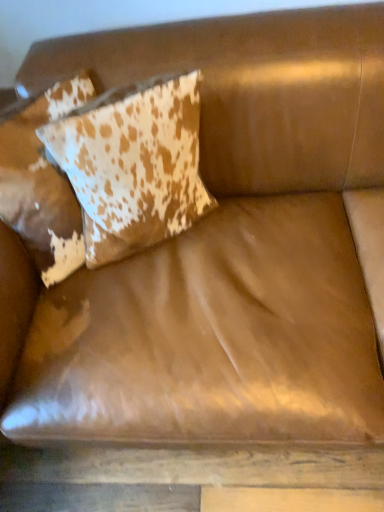
The height and width of the screenshot is (512, 384). What do you see at coordinates (133, 164) in the screenshot?
I see `cowhide pillow at upper left, which appears as the 2th pillow when viewed from the left` at bounding box center [133, 164].

The height and width of the screenshot is (512, 384). I want to click on cowhide pillow at upper left, which appears as the 2th pillow when viewed from the left, so click(133, 164).

Identify the location of cowhide pillow at upper left, which ranks as the first pillow in left-to-right order. (42, 181).

This screenshot has width=384, height=512. Describe the element at coordinates (42, 181) in the screenshot. I see `cowhide pillow at upper left, which ranks as the second pillow in right-to-left order` at that location.

Where is `cowhide pillow at upper left, which is the first pillow from right to left`? cowhide pillow at upper left, which is the first pillow from right to left is located at coordinates (133, 164).

Between cowhide pillow at upper left, which ranks as the first pillow in left-to-right order, and cowhide pillow at upper left, which is the first pillow from right to left, which one appears on the right side from the viewer's perspective?

Positioned to the right is cowhide pillow at upper left, which is the first pillow from right to left.

Which object is further away from the camera, cowhide pillow at upper left, which ranks as the first pillow in left-to-right order, or cowhide pillow at upper left, which appears as the 2th pillow when viewed from the left?

Positioned behind is cowhide pillow at upper left, which ranks as the first pillow in left-to-right order.

Is point (74, 236) in front of point (151, 148)?

That is False.

From the image's perspective, which one is positioned higher, cowhide pillow at upper left, which ranks as the second pillow in right-to-left order, or cowhide pillow at upper left, which is the first pillow from right to left?

cowhide pillow at upper left, which is the first pillow from right to left, from the image's perspective.

From a real-world perspective, does cowhide pillow at upper left, which ranks as the second pillow in right-to-left order, sit lower than cowhide pillow at upper left, which is the first pillow from right to left?

Yes, from a real-world perspective, cowhide pillow at upper left, which ranks as the second pillow in right-to-left order, is beneath cowhide pillow at upper left, which is the first pillow from right to left.

Which of these two, cowhide pillow at upper left, which ranks as the second pillow in right-to-left order, or cowhide pillow at upper left, which is the first pillow from right to left, is wider?

cowhide pillow at upper left, which ranks as the second pillow in right-to-left order, is wider.

Between cowhide pillow at upper left, which ranks as the first pillow in left-to-right order, and cowhide pillow at upper left, which appears as the 2th pillow when viewed from the left, which one has more height?

Standing taller between the two is cowhide pillow at upper left, which appears as the 2th pillow when viewed from the left.

Based on their sizes in the image, would you say cowhide pillow at upper left, which ranks as the second pillow in right-to-left order, is bigger or smaller than cowhide pillow at upper left, which is the first pillow from right to left?

Clearly, cowhide pillow at upper left, which ranks as the second pillow in right-to-left order, is larger in size than cowhide pillow at upper left, which is the first pillow from right to left.

Is cowhide pillow at upper left, which appears as the 2th pillow when viewed from the left, completely or partially inside cowhide pillow at upper left, which ranks as the first pillow in left-to-right order?

Yes.

Is the surface of cowhide pillow at upper left, which ranks as the second pillow in right-to-left order, in direct contact with cowhide pillow at upper left, which appears as the 2th pillow when viewed from the left?

No, cowhide pillow at upper left, which ranks as the second pillow in right-to-left order, is not touching cowhide pillow at upper left, which appears as the 2th pillow when viewed from the left.

Is cowhide pillow at upper left, which ranks as the first pillow in left-to-right order, looking in the opposite direction of cowhide pillow at upper left, which is the first pillow from right to left?

No, cowhide pillow at upper left, which ranks as the first pillow in left-to-right order,'s orientation is not away from cowhide pillow at upper left, which is the first pillow from right to left.

Based on the photo, can you tell me how much cowhide pillow at upper left, which ranks as the second pillow in right-to-left order, and cowhide pillow at upper left, which is the first pillow from right to left, differ in facing direction?

The angle between the facing direction of cowhide pillow at upper left, which ranks as the second pillow in right-to-left order, and the facing direction of cowhide pillow at upper left, which is the first pillow from right to left, is 7.69 degrees.

This screenshot has height=512, width=384. In order to click on pillow to the right of cowhide pillow at upper left, which ranks as the first pillow in left-to-right order in this screenshot , I will do `click(133, 164)`.

Does cowhide pillow at upper left, which is the first pillow from right to left, appear on the right side of cowhide pillow at upper left, which ranks as the second pillow in right-to-left order?

Yes.

Is the position of cowhide pillow at upper left, which appears as the 2th pillow when viewed from the left, less distant than that of cowhide pillow at upper left, which ranks as the second pillow in right-to-left order?

Yes, cowhide pillow at upper left, which appears as the 2th pillow when viewed from the left, is closer to the camera.

Which is closer to the camera, (x=150, y=93) or (x=9, y=146)?

Point (x=150, y=93) is closer to the camera than point (x=9, y=146).

From the image's perspective, is cowhide pillow at upper left, which is the first pillow from right to left, over cowhide pillow at upper left, which ranks as the second pillow in right-to-left order?

Yes, from the image's perspective, cowhide pillow at upper left, which is the first pillow from right to left, is over cowhide pillow at upper left, which ranks as the second pillow in right-to-left order.

From a real-world perspective, does cowhide pillow at upper left, which is the first pillow from right to left, sit lower than cowhide pillow at upper left, which ranks as the second pillow in right-to-left order?

Actually, cowhide pillow at upper left, which is the first pillow from right to left, is physically above cowhide pillow at upper left, which ranks as the second pillow in right-to-left order, in the real world.

Does cowhide pillow at upper left, which is the first pillow from right to left, have a greater width compared to cowhide pillow at upper left, which ranks as the first pillow in left-to-right order?

In fact, cowhide pillow at upper left, which is the first pillow from right to left, might be narrower than cowhide pillow at upper left, which ranks as the first pillow in left-to-right order.

Between cowhide pillow at upper left, which is the first pillow from right to left, and cowhide pillow at upper left, which ranks as the second pillow in right-to-left order, which one has more height?

cowhide pillow at upper left, which is the first pillow from right to left, is taller.

Considering the sizes of cowhide pillow at upper left, which is the first pillow from right to left, and cowhide pillow at upper left, which ranks as the first pillow in left-to-right order, in the image, is cowhide pillow at upper left, which is the first pillow from right to left, bigger or smaller than cowhide pillow at upper left, which ranks as the first pillow in left-to-right order,?

In the image, cowhide pillow at upper left, which is the first pillow from right to left, appears to be smaller than cowhide pillow at upper left, which ranks as the first pillow in left-to-right order.

Can we say cowhide pillow at upper left, which is the first pillow from right to left, lies outside cowhide pillow at upper left, which ranks as the first pillow in left-to-right order?

That's correct, cowhide pillow at upper left, which is the first pillow from right to left, is outside of cowhide pillow at upper left, which ranks as the first pillow in left-to-right order.

Are cowhide pillow at upper left, which appears as the 2th pillow when viewed from the left, and cowhide pillow at upper left, which ranks as the first pillow in left-to-right order, located far from each other?

cowhide pillow at upper left, which appears as the 2th pillow when viewed from the left, is near cowhide pillow at upper left, which ranks as the first pillow in left-to-right order, not far away.

Is cowhide pillow at upper left, which appears as the 2th pillow when viewed from the left, turned away from cowhide pillow at upper left, which ranks as the second pillow in right-to-left order?

Yes.

What's the angular difference between cowhide pillow at upper left, which is the first pillow from right to left, and cowhide pillow at upper left, which ranks as the first pillow in left-to-right order,'s facing directions?

cowhide pillow at upper left, which is the first pillow from right to left, and cowhide pillow at upper left, which ranks as the first pillow in left-to-right order, are facing 7.69 degrees away from each other.

How far apart are cowhide pillow at upper left, which is the first pillow from right to left, and cowhide pillow at upper left, which ranks as the second pillow in right-to-left order?

The distance of cowhide pillow at upper left, which is the first pillow from right to left, from cowhide pillow at upper left, which ranks as the second pillow in right-to-left order, is 5.10 inches.

Image resolution: width=384 pixels, height=512 pixels. In order to click on pillow above the cowhide pillow at upper left, which ranks as the second pillow in right-to-left order (from a real-world perspective) in this screenshot , I will do `click(133, 164)`.

Where is `pillow that is under the cowhide pillow at upper left, which is the first pillow from right to left (from a real-world perspective)`? This screenshot has width=384, height=512. pillow that is under the cowhide pillow at upper left, which is the first pillow from right to left (from a real-world perspective) is located at coordinates (42, 181).

What are the coordinates of `pillow that is behind the cowhide pillow at upper left, which is the first pillow from right to left` in the screenshot? It's located at (42, 181).